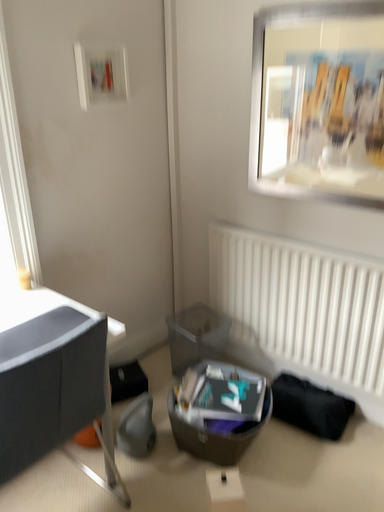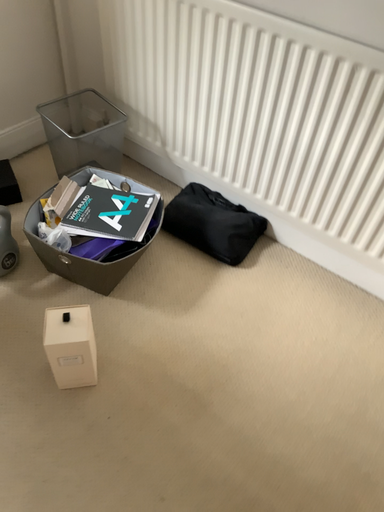
Question: Which way did the camera rotate in the video?

Choices:
 (A) rotated upward
 (B) rotated downward

Answer: (B)